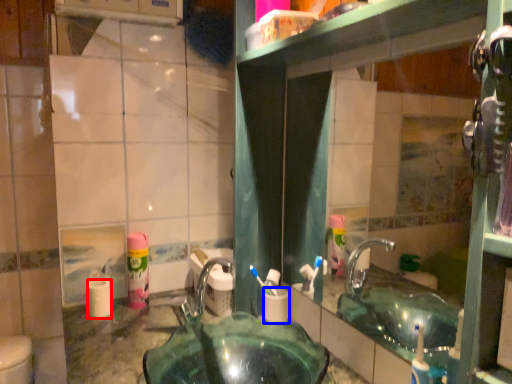
Question: Which point is closer to the camera, toilet paper (highlighted by a red box) or toilet paper (highlighted by a blue box)?

Choices:
 (A) toilet paper
 (B) toilet paper

Answer: (B)